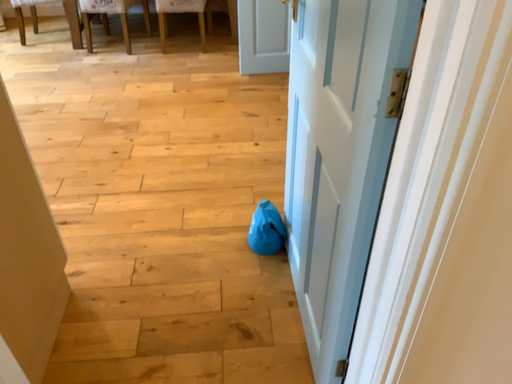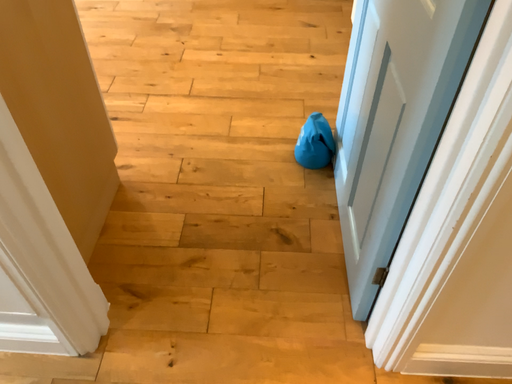
Question: Which way did the camera rotate in the video?

Choices:
 (A) rotated downward
 (B) rotated upward

Answer: (A)